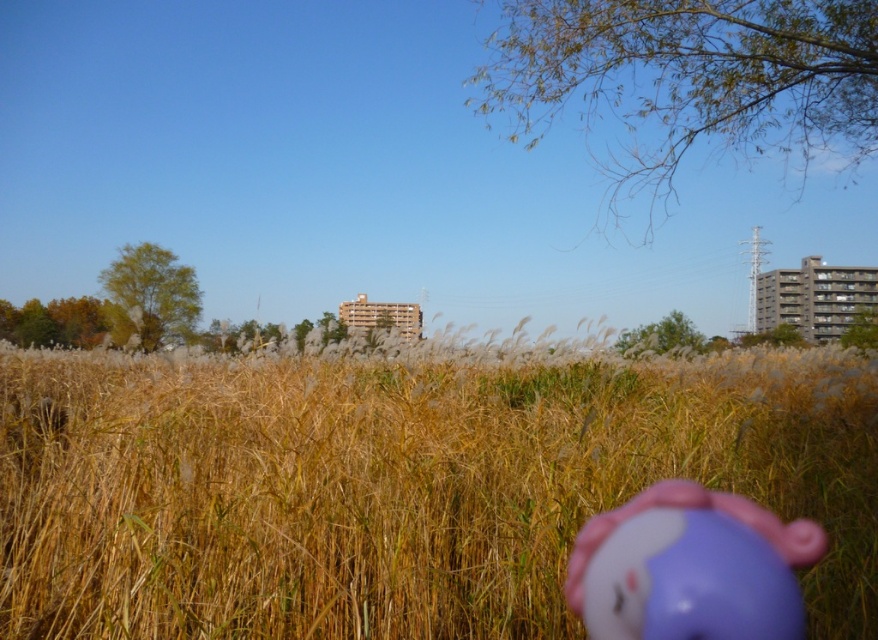
Who is higher up, yellow dry grass at center or purple matte toy at center?

yellow dry grass at center is higher up.

Which of these two, yellow dry grass at center or purple matte toy at center, stands shorter?

purple matte toy at center is shorter.

Is point (62, 420) positioned in front of point (702, 504)?

No.

Locate an element on the screen. The height and width of the screenshot is (640, 878). yellow dry grass at center is located at coordinates (397, 486).